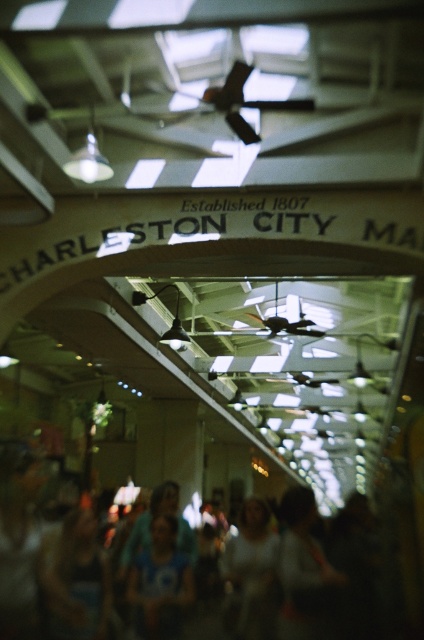
Is blurred cotton crowd at lower center wider than blue fabric shirt at center?

Correct, the width of blurred cotton crowd at lower center exceeds that of blue fabric shirt at center.

Between point (278, 621) and point (159, 577), which one is positioned in front?

Positioned in front is point (278, 621).

This screenshot has width=424, height=640. Identify the location of blurred cotton crowd at lower center. (298, 572).